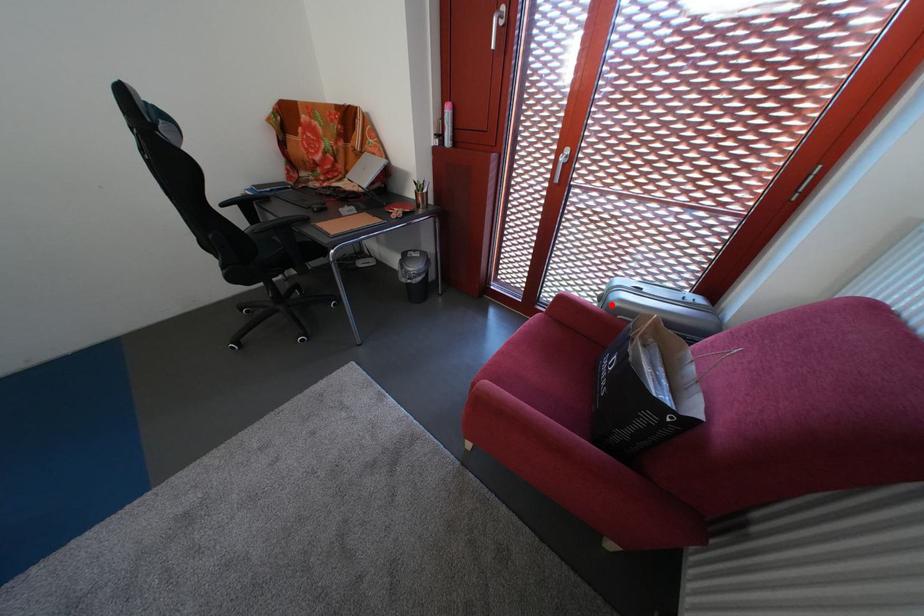
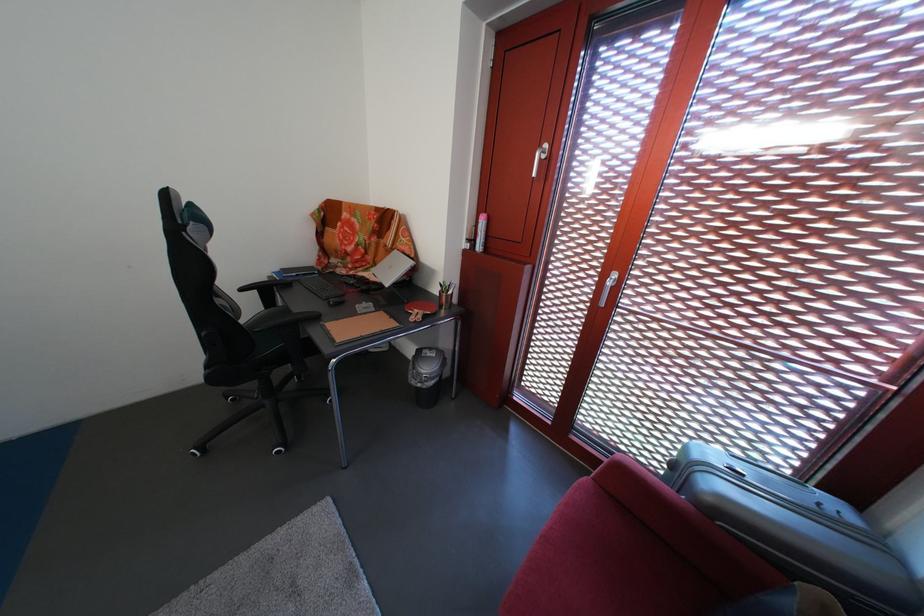
Question: I am providing you with two images of the same scene from different viewpoints. A red point is marked on the first image. Is the red point's position out of view in image 2?

Choices:
 (A) Yes
 (B) No

Answer: (B)